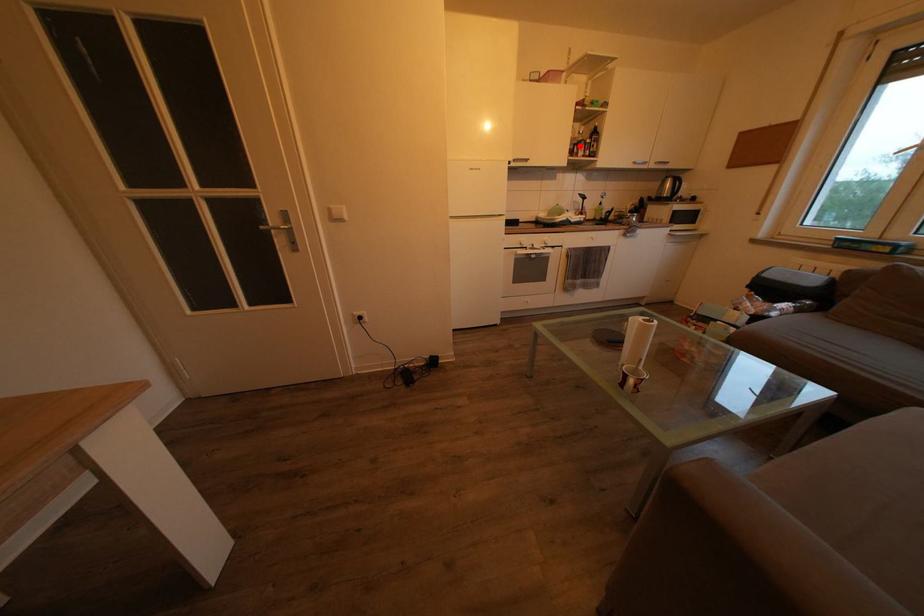
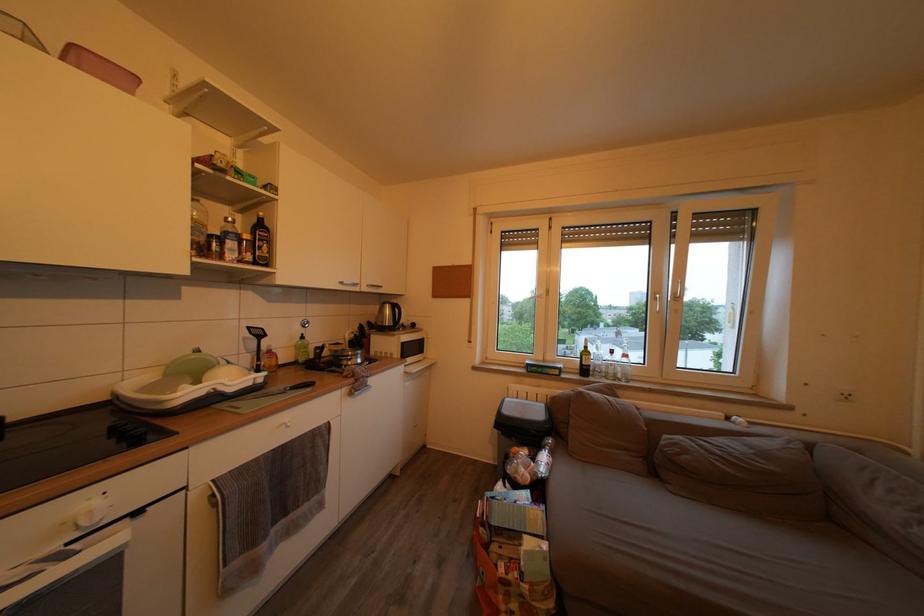
Where in the second image is the point corresponding to the highlighted location from the first image?

(205, 230)